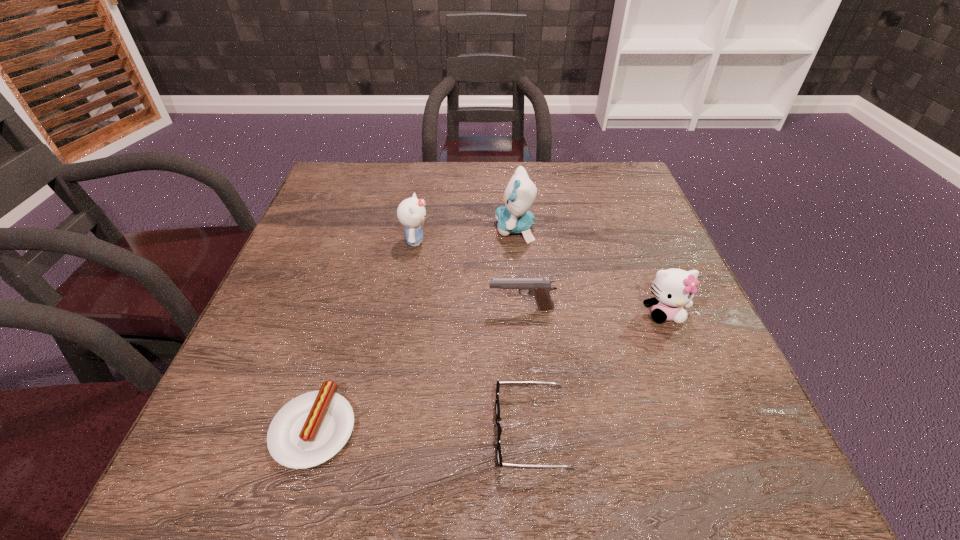
Find the location of `the tallest kitten`. the tallest kitten is located at coordinates (514, 217).

Identify the location of the tallest object. (514, 217).

Image resolution: width=960 pixels, height=540 pixels. Identify the location of the leftmost kitten. (411, 212).

At what (x,y) coordinates should I click in order to perform the action: click on the rightmost object. Please return your answer as a coordinate pair (x, y). This screenshot has height=540, width=960. Looking at the image, I should click on (673, 288).

Find the location of a particular element. The width and height of the screenshot is (960, 540). the nearest kitten is located at coordinates (673, 288).

You are a GUI agent. You are given a task and a screenshot of the screen. Output one action in this format:
    pyautogui.click(x=<x>, y=<y>)
    Task: Click on the third shortest object
    
    Given the screenshot: What is the action you would take?
    pyautogui.click(x=539, y=288)

You are a GUI agent. You are given a task and a screenshot of the screen. Output one action in this format:
    pyautogui.click(x=<x>, y=<y>)
    Task: Click on the spectacles
    The height and width of the screenshot is (540, 960).
    Given the screenshot: What is the action you would take?
    pyautogui.click(x=497, y=406)

You are a GUI agent. You are given a task and a screenshot of the screen. Output one action in this format:
    pyautogui.click(x=<x>, y=<y>)
    Task: Click on the sausage
    
    Given the screenshot: What is the action you would take?
    pyautogui.click(x=312, y=428)

Locate an element on the screen. the leftmost object is located at coordinates pyautogui.click(x=312, y=428).

This screenshot has height=540, width=960. Identify the location of vacant space located 0.280m on the face of the tallest object. (379, 229).